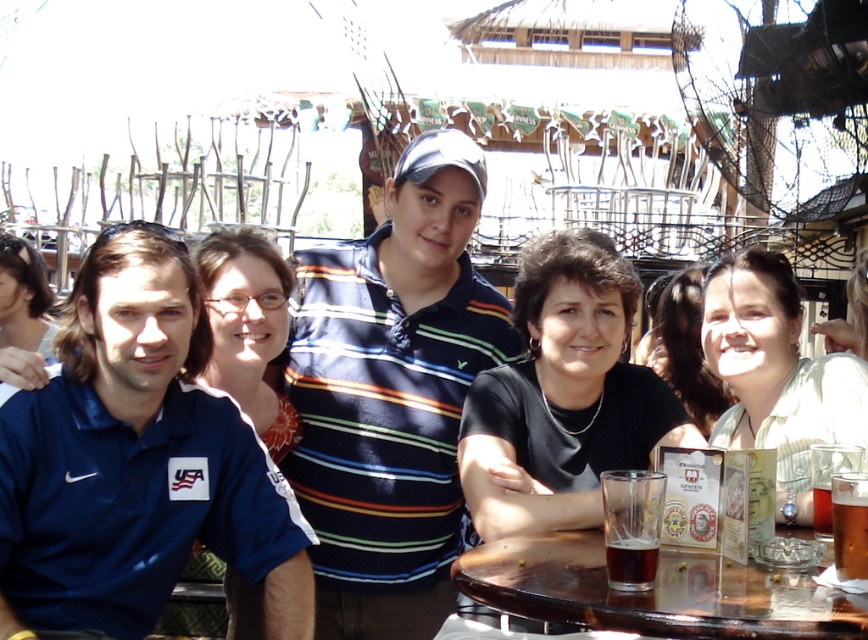
Question: Which object is the farthest from the light green shirt at center?

Choices:
 (A) black matte shirt at center
 (B) light beige blouse at center
 (C) blue cotton polo shirt at center

Answer: (C)

Question: Which of the following is the farthest from the observer?

Choices:
 (A) dark amber liquid at table center
 (B) blue cotton polo shirt at center
 (C) light beige blouse at center

Answer: (C)

Question: Which point is farther to the camera?

Choices:
 (A) matte blue shirt at left
 (B) blue cotton polo shirt at center
 (C) wooden table at lower center

Answer: (B)

Question: In this image, where is blue cotton polo shirt at center located relative to brown glass at table right?

Choices:
 (A) below
 (B) above

Answer: (B)

Question: Considering the relative positions of black matte shirt at center and wooden table at lower center in the image provided, where is black matte shirt at center located with respect to wooden table at lower center?

Choices:
 (A) left
 (B) right

Answer: (A)

Question: Does blue cotton polo shirt at center appear over light beige blouse at center?

Choices:
 (A) no
 (B) yes

Answer: (B)